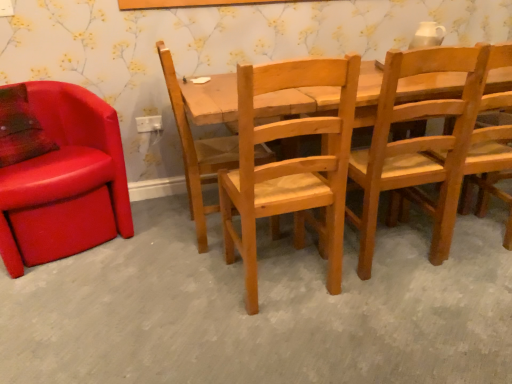
Find the location of `free space in front of leather at left, which appears as the 1th chair when viewed from the left`. free space in front of leather at left, which appears as the 1th chair when viewed from the left is located at coordinates (68, 300).